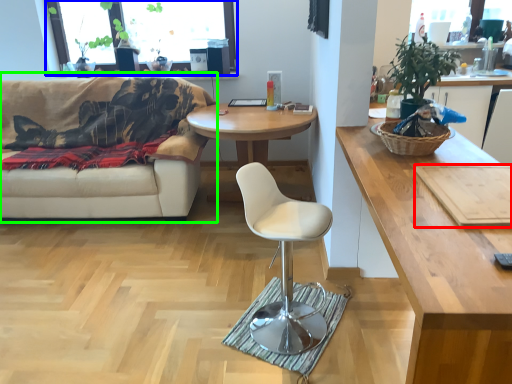
Question: Which object is positioned closest to plank (highlighted by a red box)? Select from window screen (highlighted by a blue box) and studio couch (highlighted by a green box).

Choices:
 (A) window screen
 (B) studio couch

Answer: (B)